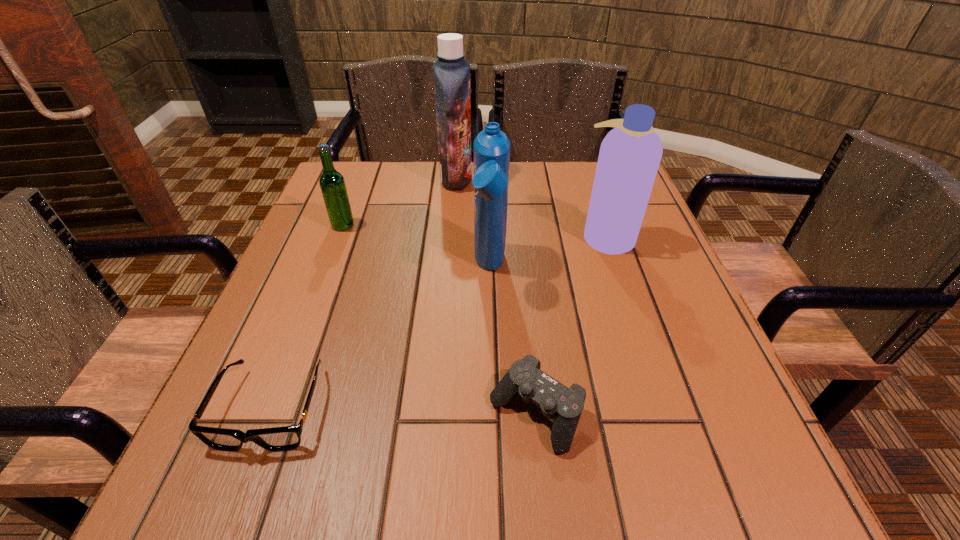
At what (x,y) coordinates should I click in order to perform the action: click on vacant point that satisfies the following two spatial constraints: 1. on the back side of the second shampoo from right to left; 2. on the left side of the rightmost object. Please return your answer as a coordinate pair (x, y). The width and height of the screenshot is (960, 540). Looking at the image, I should click on (489, 237).

Find the location of a particular element. vacant point that satisfies the following two spatial constraints: 1. on the front-facing side of the shortest object; 2. on the right side of the control is located at coordinates (270, 413).

This screenshot has height=540, width=960. What are the coordinates of `blank area in the image that satisfies the following two spatial constraints: 1. on the front side of the fifth tallest object; 2. on the left side of the beer bottle` in the screenshot? It's located at (272, 413).

Locate an element on the screen. This screenshot has width=960, height=540. vacant region that satisfies the following two spatial constraints: 1. on the front label of the farthest object; 2. on the front side of the beer bottle is located at coordinates [x=452, y=225].

The image size is (960, 540). What are the coordinates of `vacant region that satisfies the following two spatial constraints: 1. on the front label of the fourth object from right to left; 2. on the front-facing side of the shortest object` in the screenshot? It's located at (439, 408).